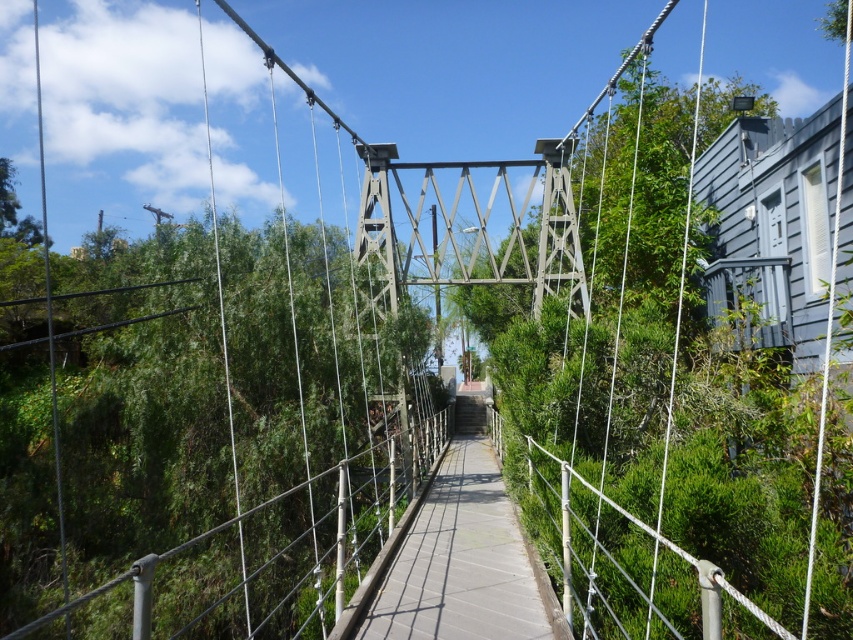
You are standing at the entrance of the suspension bridge and see the green leafy tree at center in the distance. If your camera has a focal length of 50mm and you want to capture the entire tree in your photo without moving closer, what adjustment can you make to ensure the tree fits within the frame?

You can zoom out to a wider focal length to ensure the green leafy tree at center fits within the frame.

You are standing on the suspension bridge and notice a specific point marked at coordinates (213, 445). Based on the scene description, what object is located at this point?

The point at coordinates (213, 445) is on a green leafy tree at center.

You are a hiker planning to cross the suspension bridge. You notice the green leafy tree at center and the concrete walkway at center. Which object is bigger in size?

The green leafy tree at center is larger in size compared to the concrete walkway at center.